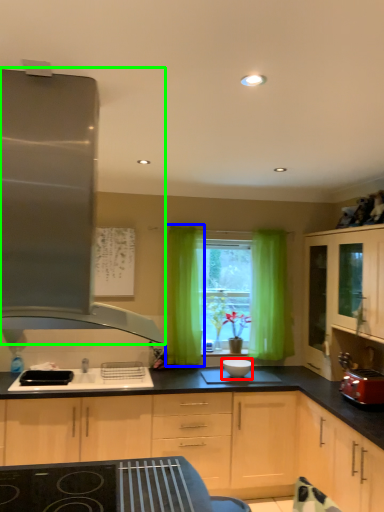
Question: Based on their relative distances, which object is farther from appliance (highlighted by a red box)? Choose from curtain (highlighted by a blue box) and kitchen appliance (highlighted by a green box).

Choices:
 (A) curtain
 (B) kitchen appliance

Answer: (B)